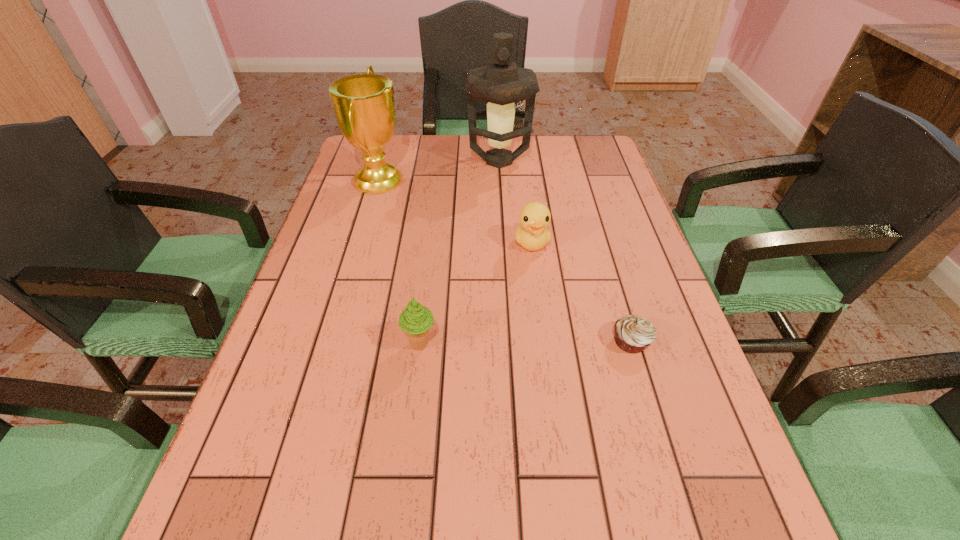
Find the location of `vacant space situated 0.170m on the right of the second object from left to right`. vacant space situated 0.170m on the right of the second object from left to right is located at coordinates (519, 345).

Locate an element on the screen. Image resolution: width=960 pixels, height=540 pixels. free space located 0.170m on the face of the duck is located at coordinates (540, 312).

Where is `free point located on the back of the shortest object`? This screenshot has height=540, width=960. free point located on the back of the shortest object is located at coordinates (598, 231).

Identify the location of oil lamp positioned at the far edge. This screenshot has width=960, height=540. (501, 83).

Identify the location of award at the far edge. (363, 104).

You are a GUI agent. You are given a task and a screenshot of the screen. Output one action in this format:
    pyautogui.click(x=<x>, y=<y>)
    Task: Click on the object that is at the left edge
    
    Given the screenshot: What is the action you would take?
    pyautogui.click(x=363, y=104)

Find the location of a particular element. The height and width of the screenshot is (540, 960). object present at the right edge is located at coordinates (633, 334).

Where is `object that is at the far left corner`? The image size is (960, 540). object that is at the far left corner is located at coordinates pos(363,104).

Image resolution: width=960 pixels, height=540 pixels. What are the coordinates of `free space at the far edge of the desktop` in the screenshot? It's located at (452, 144).

Where is `free space at the left edge`? free space at the left edge is located at coordinates (290, 362).